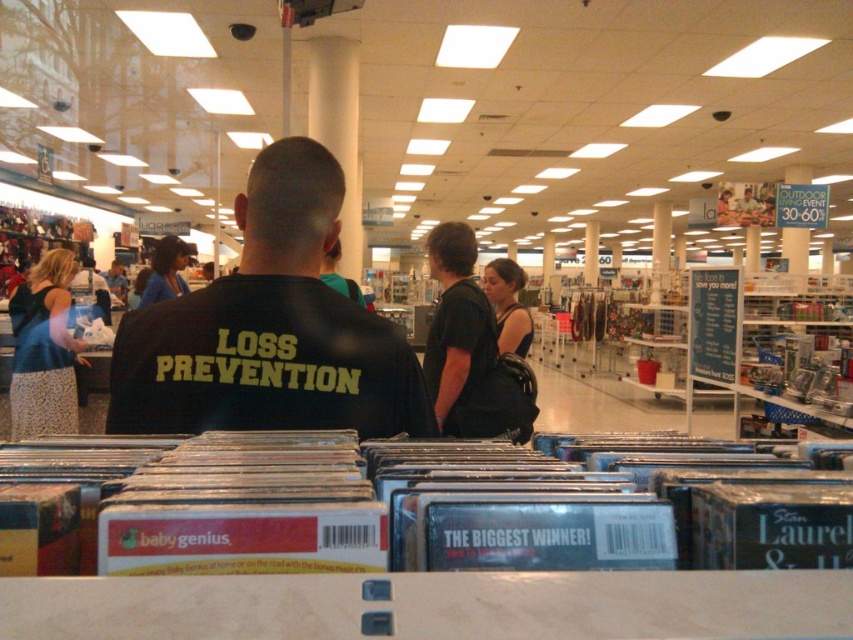
Is black fabric shirt at center taller than black leather handbag at center?

In fact, black fabric shirt at center may be shorter than black leather handbag at center.

Does black fabric shirt at center lie in front of black leather handbag at center?

Yes, it is.

Does point (221, 368) come behind point (466, 429)?

No, (221, 368) is in front of (466, 429).

At what (x,y) coordinates should I click in order to perform the action: click on black fabric shirt at center. Please return your answer as a coordinate pair (x, y). The height and width of the screenshot is (640, 853). Looking at the image, I should click on (270, 328).